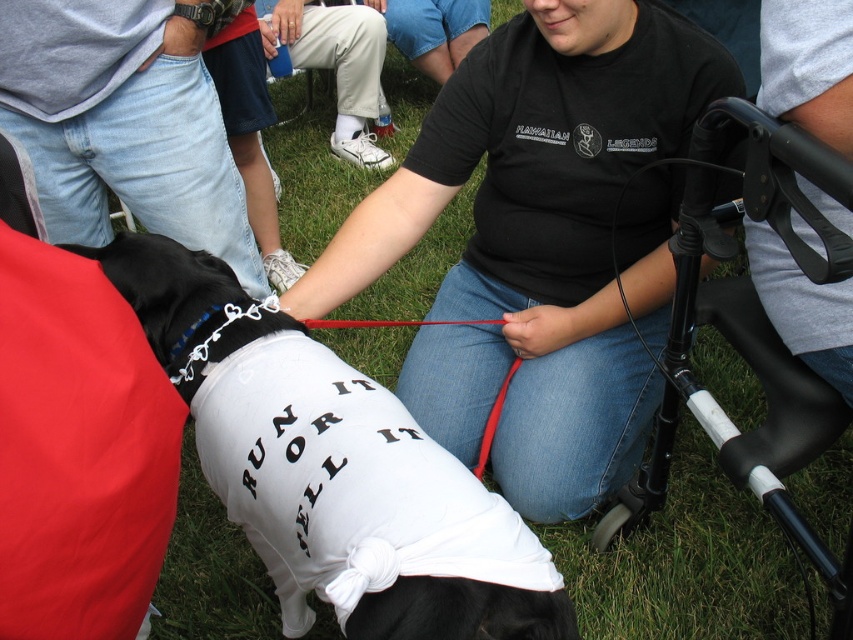
Based on the photo, you are a photographer at the event and need to position yourself to take a photo of the black matte shirt at center. According to the scene description, where should you aim your camera?

You should aim your camera at point (535, 241) to capture the black matte shirt at center.

You are standing in the scene and want to pick up the white fabric shoe at lower center. Is the black matte shirt at center blocking your direct path to it?

The black matte shirt at center is in front of the white fabric shoe at lower center, so yes, the black matte shirt at center is blocking the direct path to the white fabric shoe at lower center.